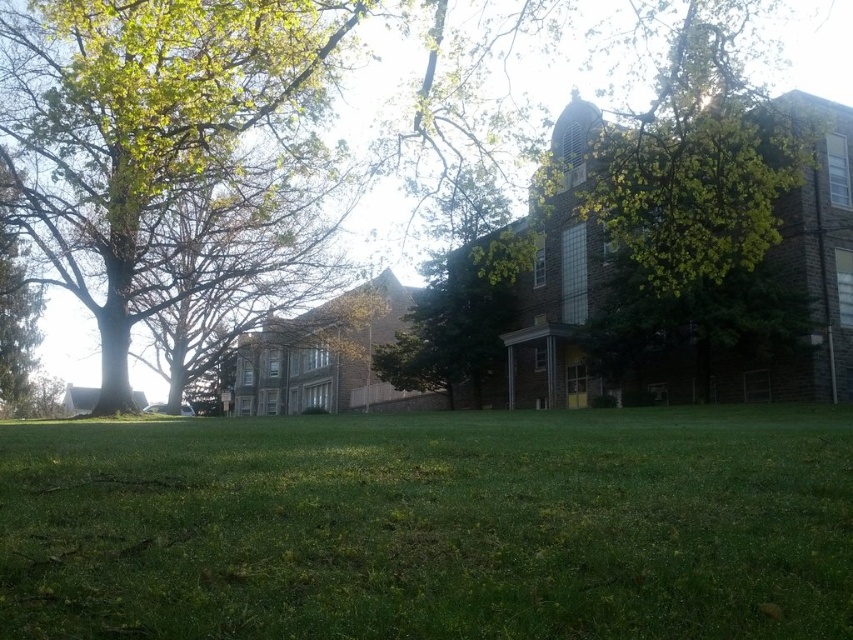
Question: Is green grass at lower center above green leafy tree at upper center?

Choices:
 (A) no
 (B) yes

Answer: (A)

Question: Which point appears farthest from the camera in this image?

Choices:
 (A) (808, 604)
 (B) (399, 54)
 (C) (93, 269)

Answer: (B)

Question: Among these objects, which one is farthest from the camera?

Choices:
 (A) green leafy tree at upper left
 (B) green grass at lower center

Answer: (A)

Question: Does green grass at lower center have a smaller size compared to green leafy tree at upper left?

Choices:
 (A) yes
 (B) no

Answer: (A)

Question: Does green grass at lower center have a smaller size compared to green leafy tree at upper center?

Choices:
 (A) yes
 (B) no

Answer: (A)

Question: Considering the real-world distances, which object is farthest from the green leafy tree at upper left?

Choices:
 (A) green grass at lower center
 (B) green leafy tree at upper center

Answer: (B)